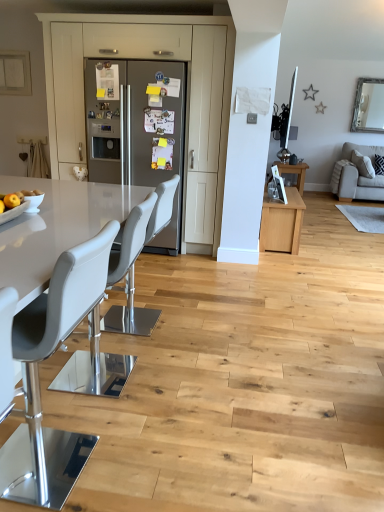
At what (x,y) coordinates should I click in order to perform the action: click on free space between gray leather bar stool at center, which is the second chair in back-to-front order, and gray leather chair at left, which is the 3th chair from back to front. Please return your answer as a coordinate pair (x, y). The height and width of the screenshot is (512, 384). Looking at the image, I should click on (89, 412).